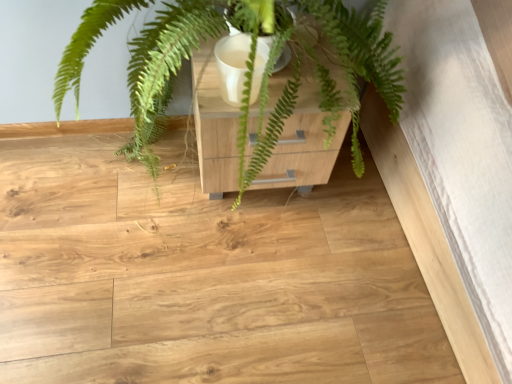
The height and width of the screenshot is (384, 512). Describe the element at coordinates (303, 144) in the screenshot. I see `wooden dresser at center` at that location.

What are the coordinates of `wooden dresser at center` in the screenshot? It's located at (303, 144).

Locate an element on the screen. Image resolution: width=512 pixels, height=384 pixels. wooden dresser at center is located at coordinates (303, 144).